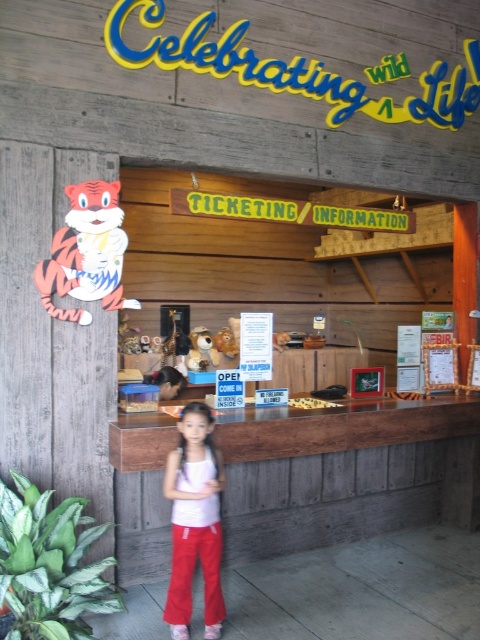
Question: Is white fabric tank top at center thinner than orange paper tiger at left?

Choices:
 (A) no
 (B) yes

Answer: (B)

Question: Does white fabric tank top at center have a larger size compared to orange paper tiger at left?

Choices:
 (A) no
 (B) yes

Answer: (A)

Question: Which point is closer to the camera?

Choices:
 (A) orange paper tiger at left
 (B) white fabric tank top at center

Answer: (B)

Question: Among these objects, which one is nearest to the camera?

Choices:
 (A) white fabric tank top at center
 (B) orange paper tiger at left

Answer: (A)

Question: Does white fabric tank top at center lie behind orange paper tiger at left?

Choices:
 (A) yes
 (B) no

Answer: (B)